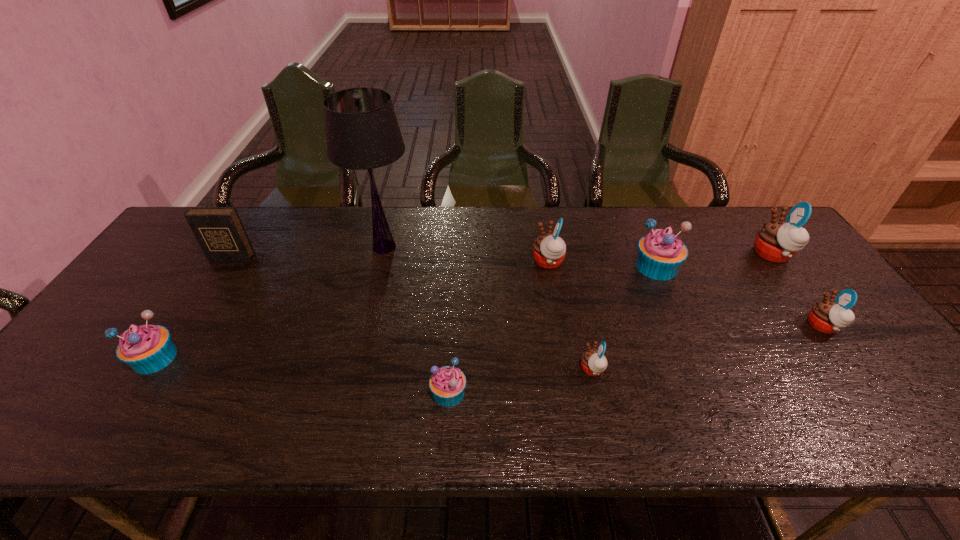
You are a GUI agent. You are given a task and a screenshot of the screen. Output one action in this format:
    pyautogui.click(x=<x>, y=<y>)
    Task: Click on the free space that is in between the second smallest pink muffin and the second biggest blue muffin
    
    Given the screenshot: What is the action you would take?
    pyautogui.click(x=489, y=342)

Locate an element on the screen. free space between the diary and the second smallest blue muffin is located at coordinates (193, 308).

Where is `unoccupied area between the smallest blue muffin and the second biggest pink muffin`? unoccupied area between the smallest blue muffin and the second biggest pink muffin is located at coordinates (498, 327).

Image resolution: width=960 pixels, height=540 pixels. Find the location of `free space between the biggest blue muffin and the fourth nearest muffin`. free space between the biggest blue muffin and the fourth nearest muffin is located at coordinates (740, 296).

You are a GUI agent. You are given a task and a screenshot of the screen. Output one action in this format:
    pyautogui.click(x=<x>, y=<y>)
    Task: Click on the free space between the diary and the biggest pink muffin
    Image resolution: width=960 pixels, height=540 pixels.
    Given the screenshot: What is the action you would take?
    tap(502, 256)

Identify the location of vacant area that lies between the second biggest pink muffin and the nearest pink muffin. (570, 315).

Find the location of `free space between the second biggest pink muffin and the lampshade`. free space between the second biggest pink muffin and the lampshade is located at coordinates (x=467, y=254).

Locate an element on the screen. The width and height of the screenshot is (960, 540). free space between the third smallest pink muffin and the leftmost blue muffin is located at coordinates (351, 310).

You are a GUI agent. You are given a task and a screenshot of the screen. Output one action in this format:
    pyautogui.click(x=<x>, y=<y>)
    Task: Click on the free point between the leftmost blue muffin and the third farthest pink muffin
    
    Given the screenshot: What is the action you would take?
    pyautogui.click(x=489, y=342)

I want to click on unoccupied position between the biggest pink muffin and the nearest pink muffin, so click(x=683, y=312).